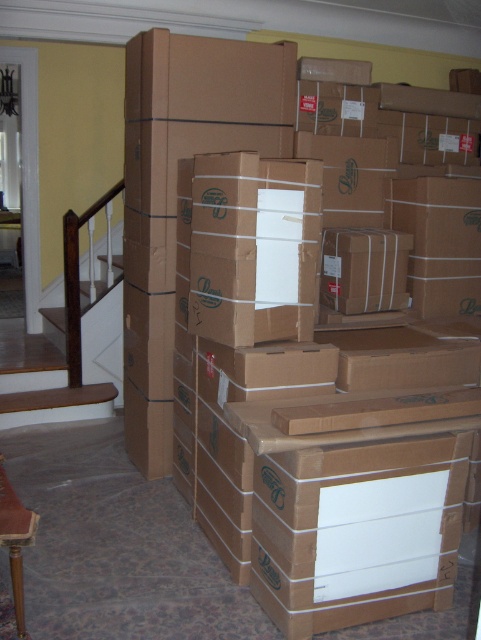
Is brown cardboard box at center bigger than wooden at left?

Yes.

Can you confirm if brown cardboard box at center is thinner than wooden at left?

No, brown cardboard box at center is not thinner than wooden at left.

Which is in front, point (299, 372) or point (50, 371)?

Positioned in front is point (299, 372).

Identify the location of brown cardboard box at center. The width and height of the screenshot is (481, 640). (301, 388).